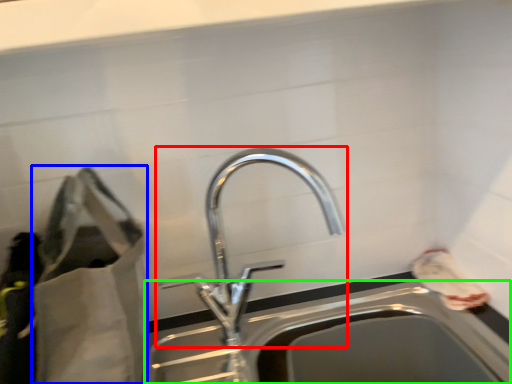
Question: Considering the real-world distances, which object is farthest from tap (highlighted by a red box)? bag (highlighted by a blue box) or sink (highlighted by a green box)?

Choices:
 (A) bag
 (B) sink

Answer: (A)